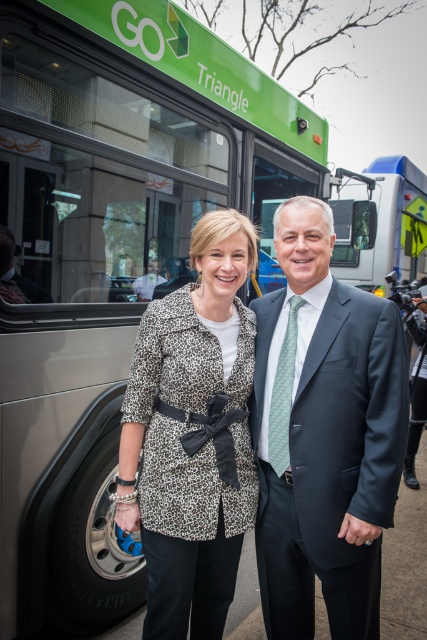
Measure the distance between dark gray suit at center and leopard print coat at center.

11.05 inches

Which is behind, point (275, 580) or point (237, 547)?

The point (237, 547) is more distant.

Is point (309, 381) farther from viewer compared to point (190, 550)?

No, (309, 381) is in front of (190, 550).

In order to click on dark gray suit at center in this screenshot , I will do `click(324, 435)`.